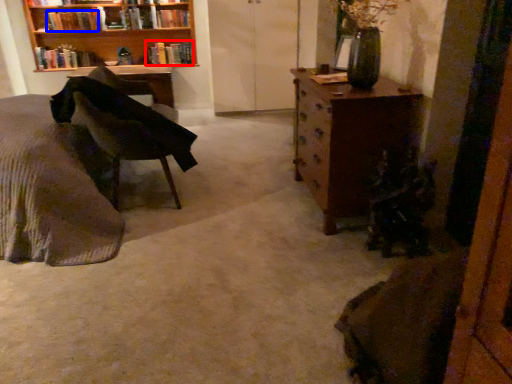
Question: Which object is closer to the camera taking this photo, book (highlighted by a red box) or book (highlighted by a blue box)?

Choices:
 (A) book
 (B) book

Answer: (B)